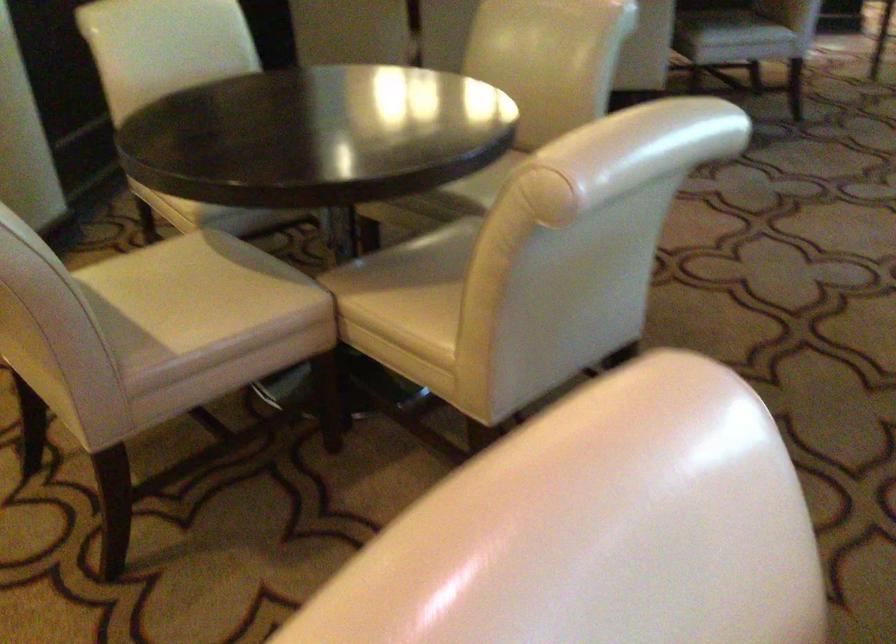
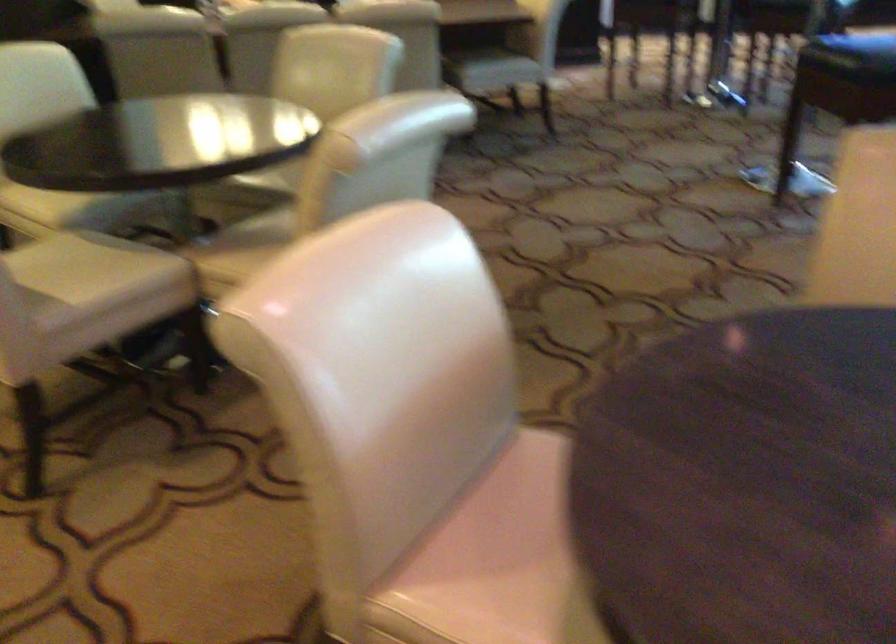
Locate, in the second image, the point that corresponds to the point at 199,290 in the first image.

(82, 266)